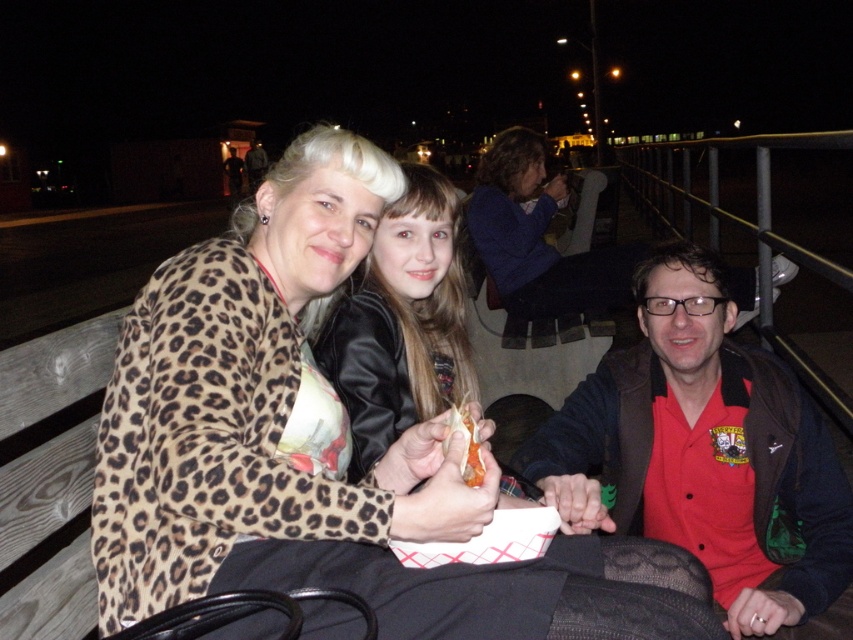
The height and width of the screenshot is (640, 853). Describe the element at coordinates (253, 397) in the screenshot. I see `leopard print jacket at left` at that location.

Between leopard print jacket at left and shiny orange carrot at center, which one has less height?

shiny orange carrot at center

Find the location of a particular element. The image size is (853, 640). leopard print jacket at left is located at coordinates coord(253,397).

Is red cotton shirt at right above leather jacket at center?

No, red cotton shirt at right is not above leather jacket at center.

Between red cotton shirt at right and leather jacket at center, which one is positioned higher?

leather jacket at center is above.

Who is more distant from viewer, (729, 480) or (428, 193)?

Point (428, 193)

At what (x,y) coordinates should I click in order to perform the action: click on red cotton shirt at right. Please return your answer as a coordinate pair (x, y). Looking at the image, I should click on (709, 449).

Is leopard print jacket at left taller than red cotton shirt at right?

Yes.

I want to click on leopard print jacket at left, so click(x=253, y=397).

Image resolution: width=853 pixels, height=640 pixels. In order to click on leopard print jacket at left in this screenshot , I will do `click(253, 397)`.

What are the coordinates of `leopard print jacket at left` in the screenshot? It's located at (253, 397).